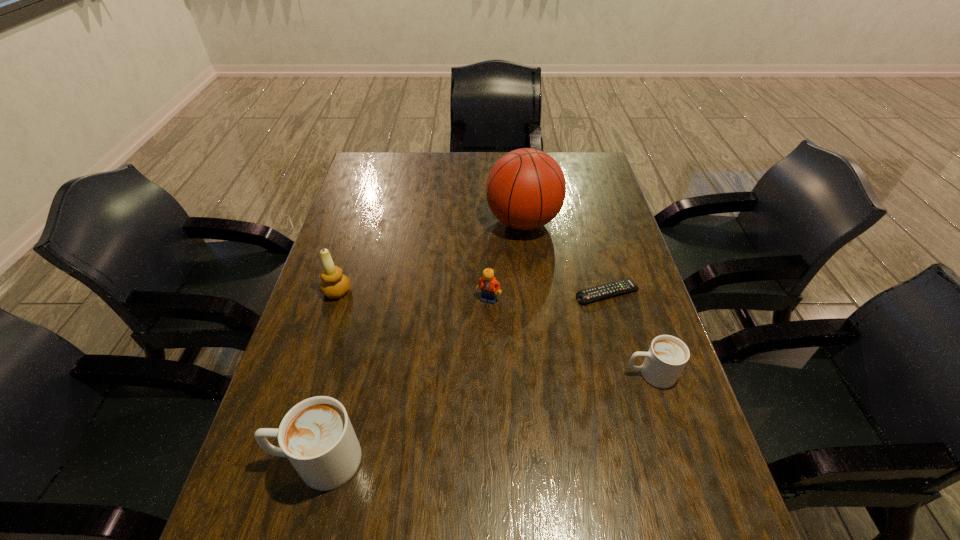
What are the coordinates of `vacant space that satisfies the following two spatial constraints: 1. on the front-facing side of the third shortest object; 2. on the side with the handle of the left cappuccino` in the screenshot? It's located at (492, 460).

Image resolution: width=960 pixels, height=540 pixels. I want to click on free spot that satisfies the following two spatial constraints: 1. on the front side of the basketball; 2. on the side with the handle of the left cappuccino, so click(549, 460).